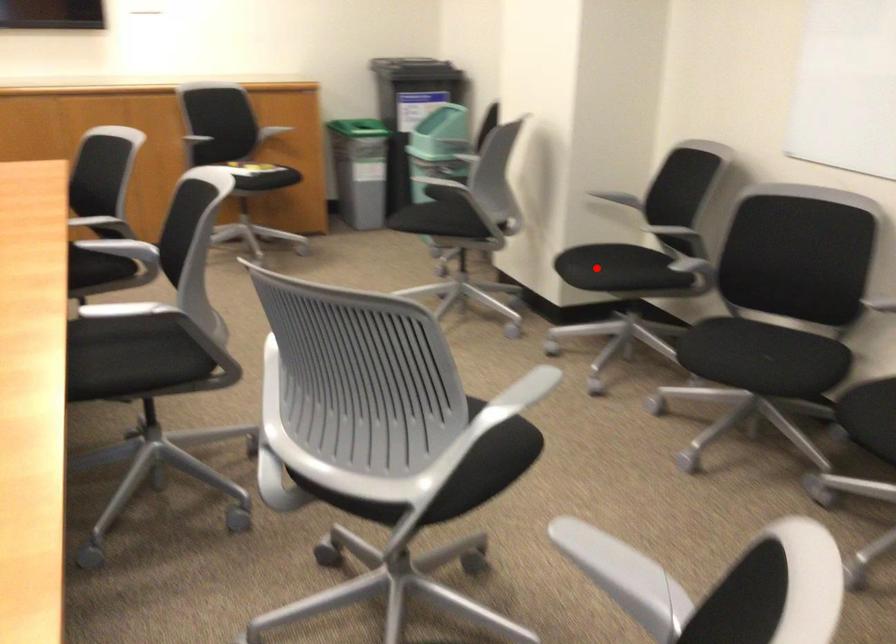
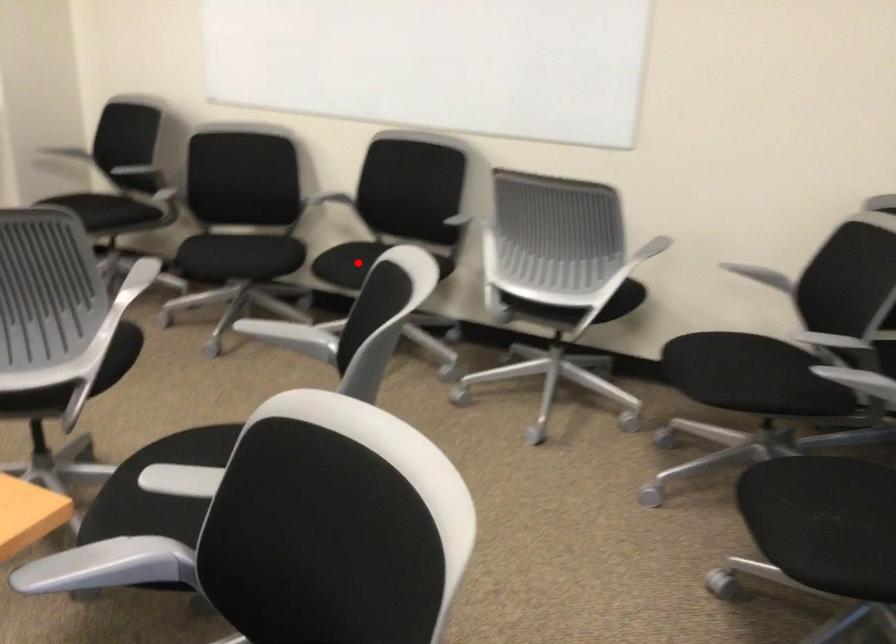
I am providing you with two images of the same scene from different viewpoints. A red point is marked on the first image and another point is marked on the second image. Does the point marked in image1 correspond to the same location as the one in image2?

No